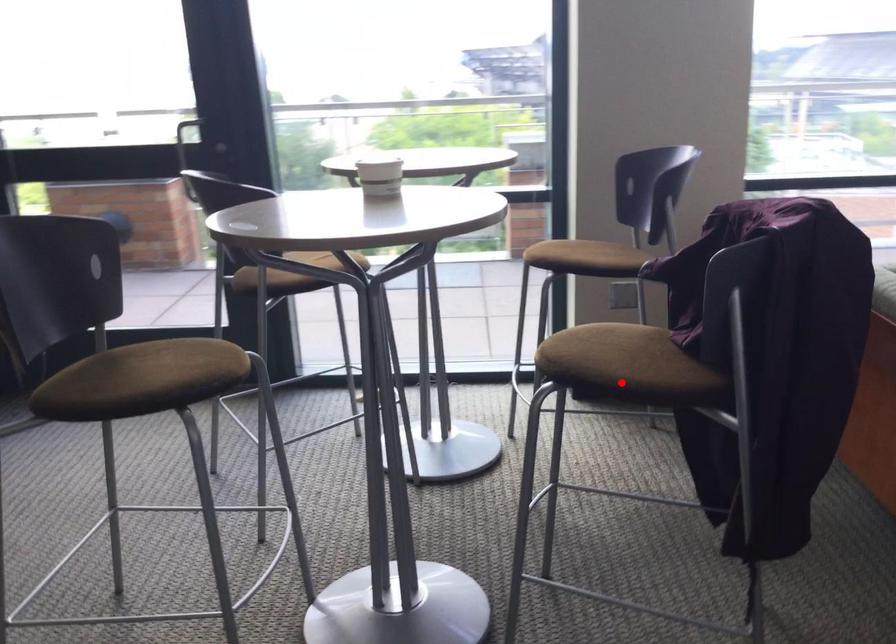
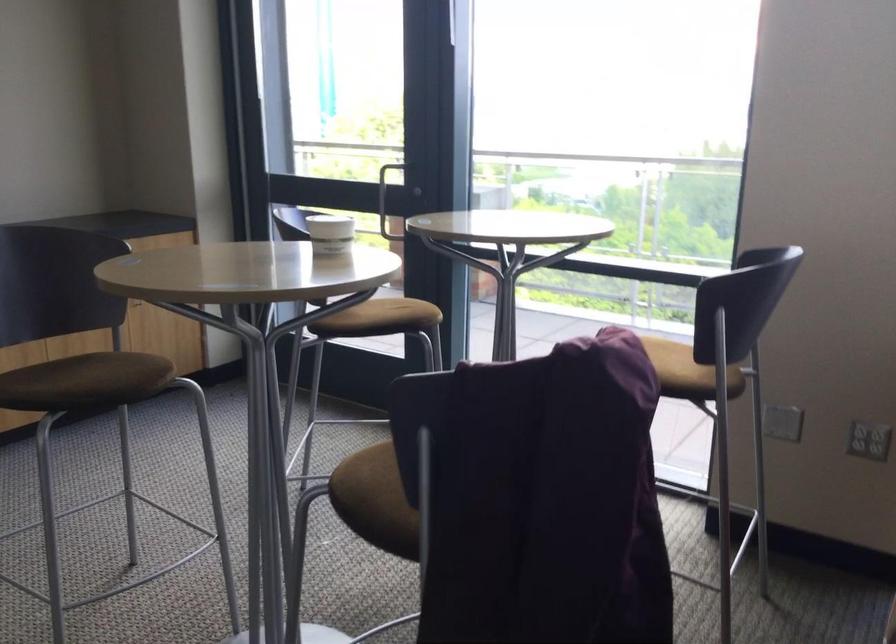
Where in the second image is the point corresponding to the highlighted location from the first image?

(369, 500)